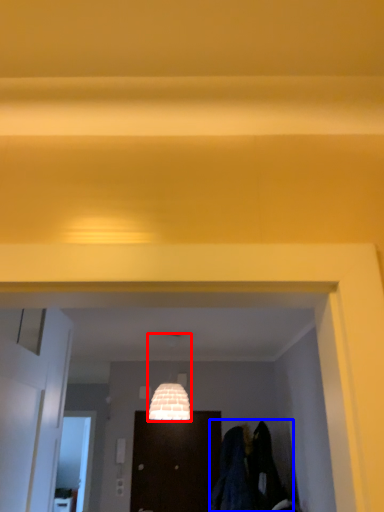
Question: Which of the following is the farthest to the observer, lamp (highlighted by a red box) or laundry (highlighted by a blue box)?

Choices:
 (A) lamp
 (B) laundry

Answer: (B)